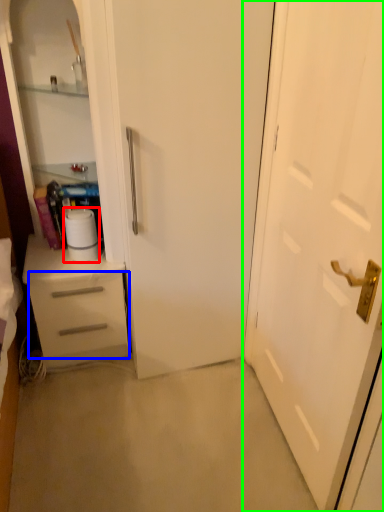
Question: Which is farther away from paper towel (highlighted by a red box)? drawer (highlighted by a blue box) or door (highlighted by a green box)?

Choices:
 (A) drawer
 (B) door

Answer: (B)